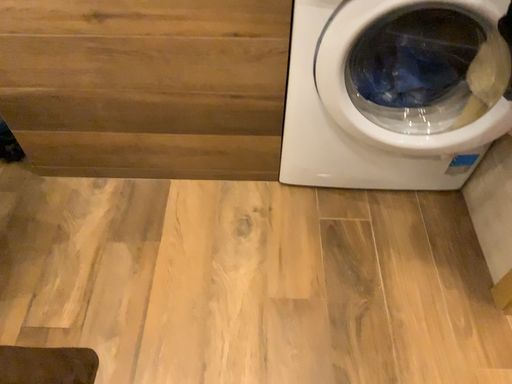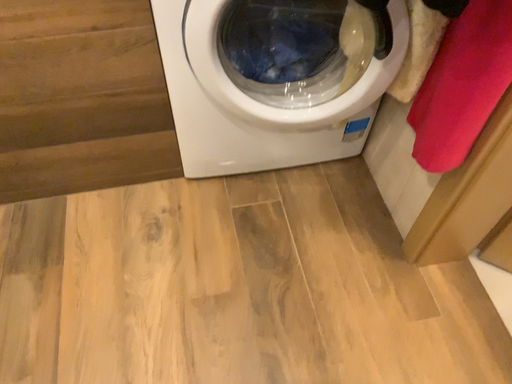
Question: How did the camera likely rotate when shooting the video?

Choices:
 (A) rotated right
 (B) rotated left

Answer: (A)